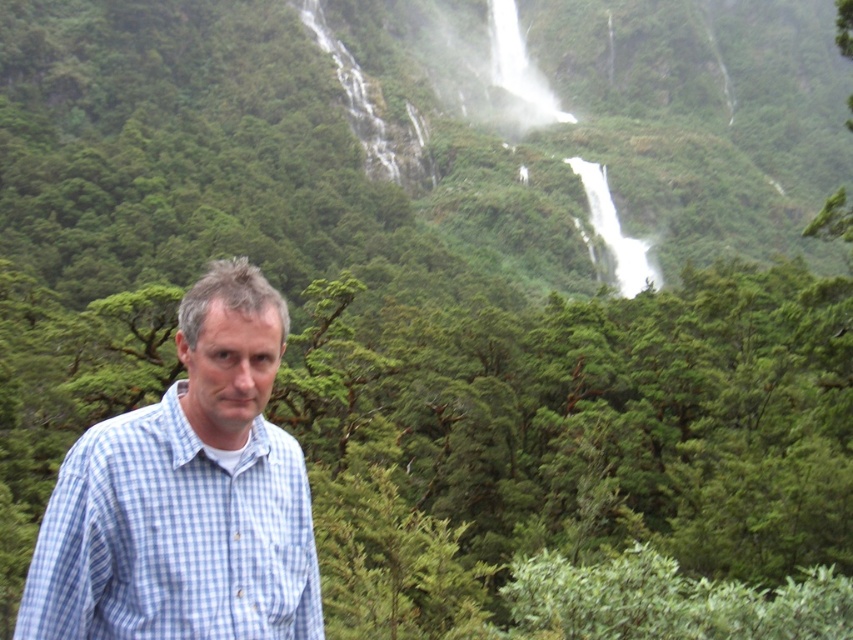
Consider the image. You are a photographer aiming to capture the man in the blue checkered shirt at center and the white frothy water at upper center in a single frame. Based on their sizes in the image, which object would appear smaller in the photo?

The blue checkered shirt at center would appear smaller in the photo because it is not as tall as the white frothy water at upper center.

You are a photographer trying to capture the man in the blue checkered shirt at center and the white frothy water at upper center in a single shot. Based on their positions, can you tell which object is closer to the camera?

The blue checkered shirt at center is closer to the camera because it is positioned below the white frothy water at upper center, indicating it is in the foreground.